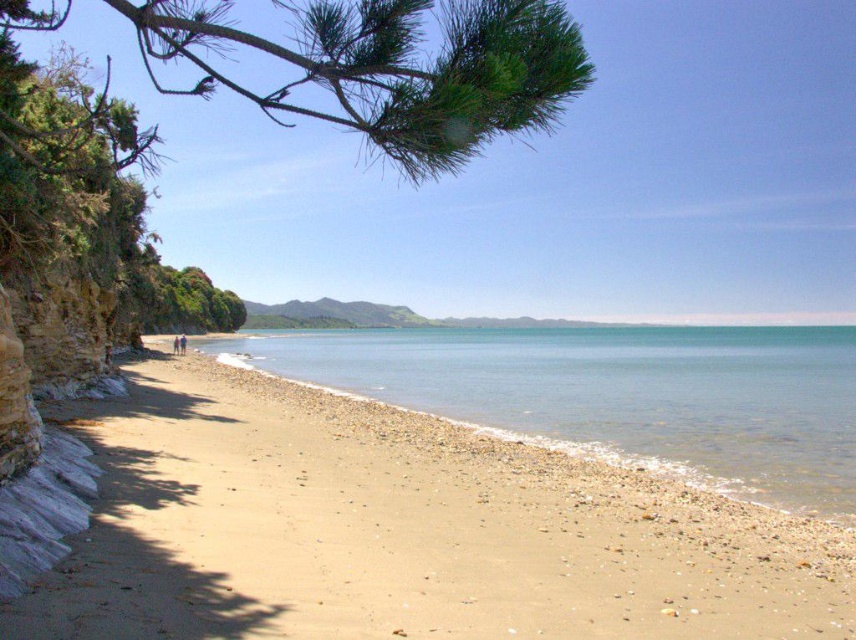
Who is taller, clear blue water at center or blue t-shirt at lower left?

Standing taller between the two is clear blue water at center.

Which is in front, point (465, 346) or point (186, 339)?

Positioned in front is point (186, 339).

What do you see at coordinates (616, 394) in the screenshot? This screenshot has height=640, width=856. I see `clear blue water at center` at bounding box center [616, 394].

Where is `clear blue water at center`? clear blue water at center is located at coordinates (616, 394).

Is light brown gravel at lower left smaller than blue t-shirt at lower left?

Indeed, light brown gravel at lower left has a smaller size compared to blue t-shirt at lower left.

What do you see at coordinates (402, 532) in the screenshot? I see `light brown gravel at lower left` at bounding box center [402, 532].

Is point (423, 605) positioned before point (183, 340)?

Yes, point (423, 605) is in front of point (183, 340).

Where is `light brown gravel at lower left`? The width and height of the screenshot is (856, 640). light brown gravel at lower left is located at coordinates (402, 532).

Based on the photo, can you confirm if blue t-shirt at lower left is positioned above blue fabric person at lower left?

Yes, blue t-shirt at lower left is above blue fabric person at lower left.

Is blue t-shirt at lower left positioned at the back of blue fabric person at lower left?

No, it is not.

You are a GUI agent. You are given a task and a screenshot of the screen. Output one action in this format:
    pyautogui.click(x=<x>, y=<y>)
    Task: Click on the blue t-shirt at lower left
    
    Given the screenshot: What is the action you would take?
    pyautogui.click(x=182, y=342)